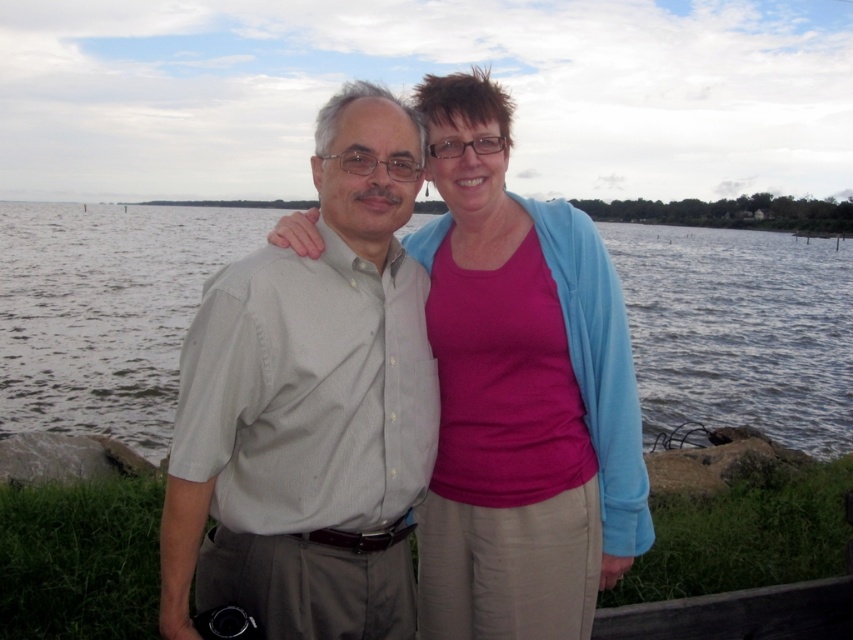
You are a photographer trying to capture a landscape photo of the clear water at center and the light gray shirt at center. Which object should you focus on first if you want to ensure both are in focus? Please explain your reasoning based on their sizes.

The light gray shirt at center has a smaller size compared to clear water at center. To ensure both are in focus, you should focus on the smaller object, the light gray shirt at center, because depth of field is more effective when focusing on closer or smaller subjects.

You are standing at the point marked by the coordinates point (x=413, y=112). You want to walk towards the man on the left and the woman on the right. Which direction should you move to reach them?

The point (x=413, y=112) is 2.41 meters away from the viewer. Since the man on the left and woman on the right are part of the scene, you should move forward towards them as they are in front of you at that point.

You are a photographer trying to capture a portrait of the two people in the scene. You notice the pink matte shirt at center and the clear water at center. Which object takes up more space in the frame?

The clear water at center takes up more space in the frame because it has a greater width than the pink matte shirt at center.